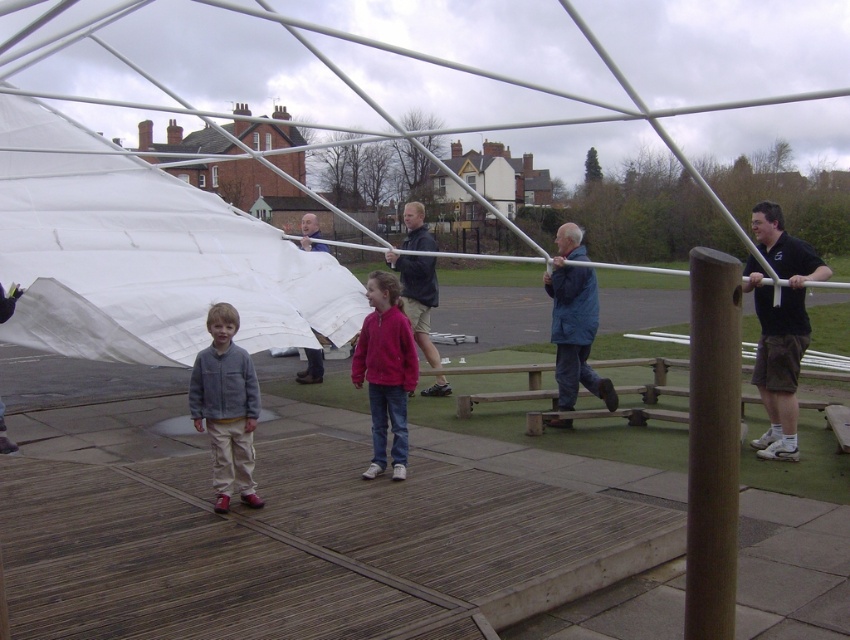
Question: Observing the image, what is the correct spatial positioning of light gray fleece jacket at center in reference to blue fabric jacket at center?

Choices:
 (A) above
 (B) below

Answer: (B)

Question: In this image, where is matte pink jacket at center located relative to matte white tent at center?

Choices:
 (A) left
 (B) right

Answer: (B)

Question: Which point appears closest to the camera in this image?

Choices:
 (A) (604, 401)
 (B) (395, 449)
 (C) (756, 381)

Answer: (B)

Question: Which point is farther from the camera taking this photo?

Choices:
 (A) (595, 310)
 (B) (247, 412)

Answer: (A)

Question: Considering the relative positions of black shirt at right and dark blue jacket at center in the image provided, where is black shirt at right located with respect to dark blue jacket at center?

Choices:
 (A) below
 (B) above

Answer: (A)

Question: Which is nearer to the dark blue jacket at center?

Choices:
 (A) blue fabric jacket at center
 (B) black shirt at right
 (C) matte pink jacket at center
 (D) light gray fleece jacket at center

Answer: (A)